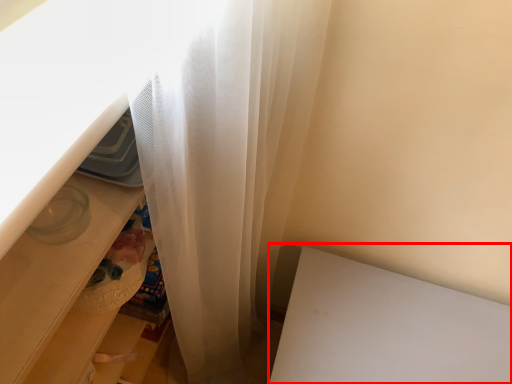
Question: In this image, where is table (annotated by the red box) located relative to drawer?

Choices:
 (A) right
 (B) left

Answer: (A)